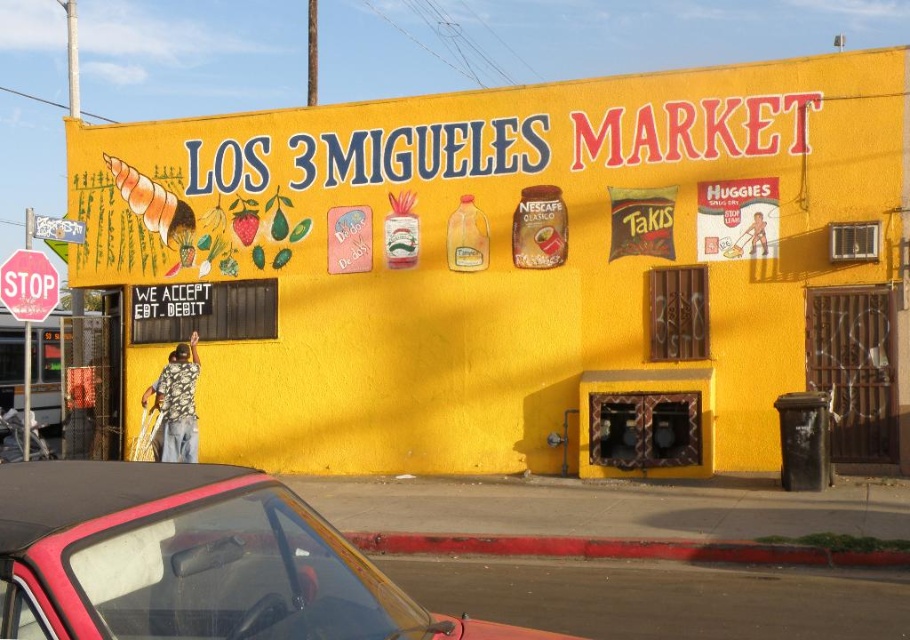
You are driving a car and see the yellow matte building at center and the red plastic stop sign at left. Which object is closer to the left side of your view?

The red plastic stop sign at left is closer to the left side of your view because it is positioned to the left of the yellow matte building at center.

Where is the yellow matte building at center located in the image?

The yellow matte building at center is located at point (526, 268).

You are a delivery driver arriving at Los 3 Miguels Market. You need to park your vehicle, which is the same size as the shiny red convertible at lower left. There is a parking spot next to the red plastic stop sign at left. Will your vehicle fit in that parking spot?

The shiny red convertible at lower left is wider than the red plastic stop sign at left. Since your vehicle is the same size as the shiny red convertible at lower left, it will not fit in the parking spot next to the red plastic stop sign at left, which is narrower.